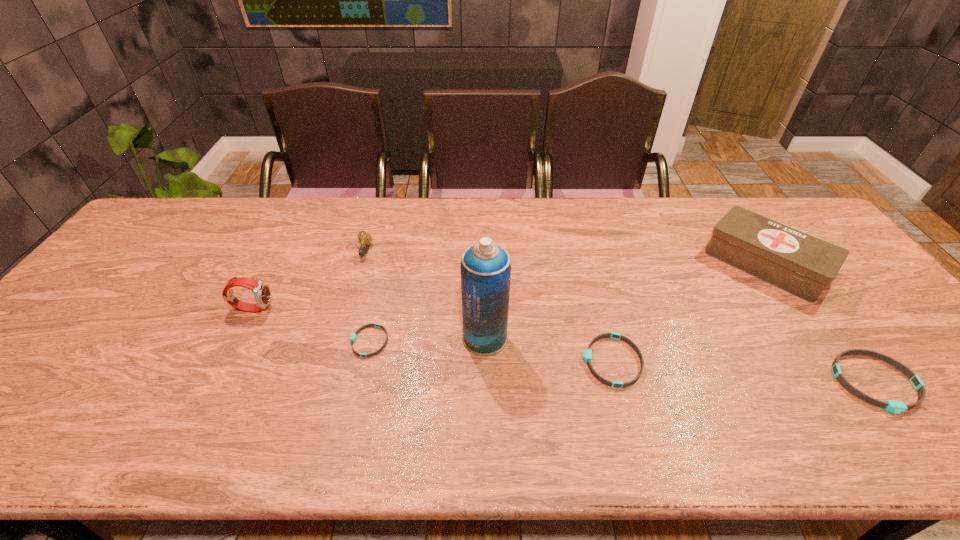
At what (x,y) coordinates should I click in order to perform the action: click on vacant space at the far right corner of the desktop. Please return your answer as a coordinate pair (x, y). Looking at the image, I should click on (787, 198).

The width and height of the screenshot is (960, 540). I want to click on free space that is in between the first-aid kit and the escargot, so click(564, 258).

Locate an element on the screen. free point between the third object from left to right and the tallest object is located at coordinates (427, 340).

Where is `free point between the leftmost object and the fourth shortest object`? The image size is (960, 540). free point between the leftmost object and the fourth shortest object is located at coordinates (309, 279).

Identify the location of free space that is in between the leftmost object and the escargot. The width and height of the screenshot is (960, 540). (309, 279).

Where is `vacant space in between the aerosol can and the second wristband from right to left`? vacant space in between the aerosol can and the second wristband from right to left is located at coordinates (548, 349).

At what (x,y) coordinates should I click in order to perform the action: click on vacant area between the shortest object and the first-aid kit. Please return your answer as a coordinate pair (x, y). Image resolution: width=960 pixels, height=540 pixels. Looking at the image, I should click on (566, 303).

The height and width of the screenshot is (540, 960). Find the location of `unoccupied position between the leftmost wristband and the escargot`. unoccupied position between the leftmost wristband and the escargot is located at coordinates (367, 296).

Find the location of a particular element. The image size is (960, 540). free space between the fifth object from left to right and the aerosol can is located at coordinates (548, 349).

Locate an element on the screen. The height and width of the screenshot is (540, 960). vacant area that lies between the tallest object and the first-aid kit is located at coordinates (625, 301).